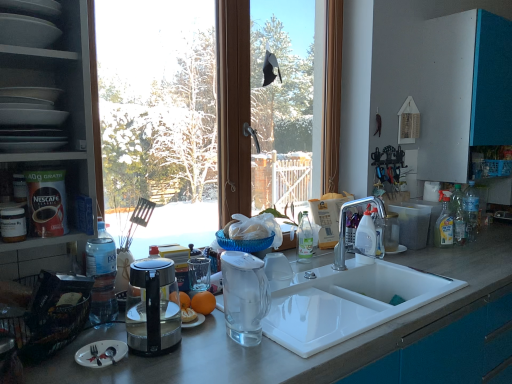
At what (x,y) coordinates should I click in order to perform the action: click on vacant space to the right of transparent glass blender at sink. Please return your answer as a coordinate pair (x, y). This screenshot has width=512, height=384. Looking at the image, I should click on (300, 332).